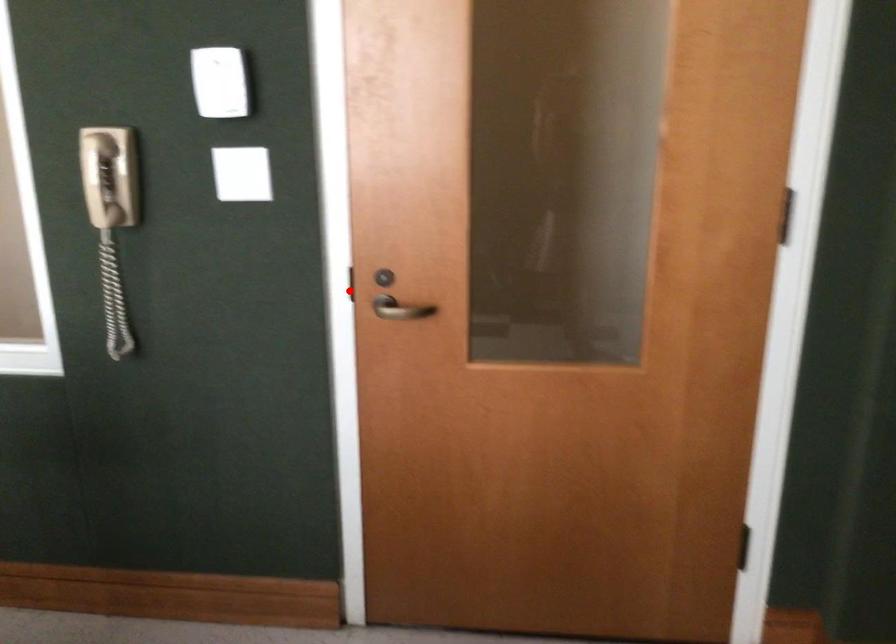
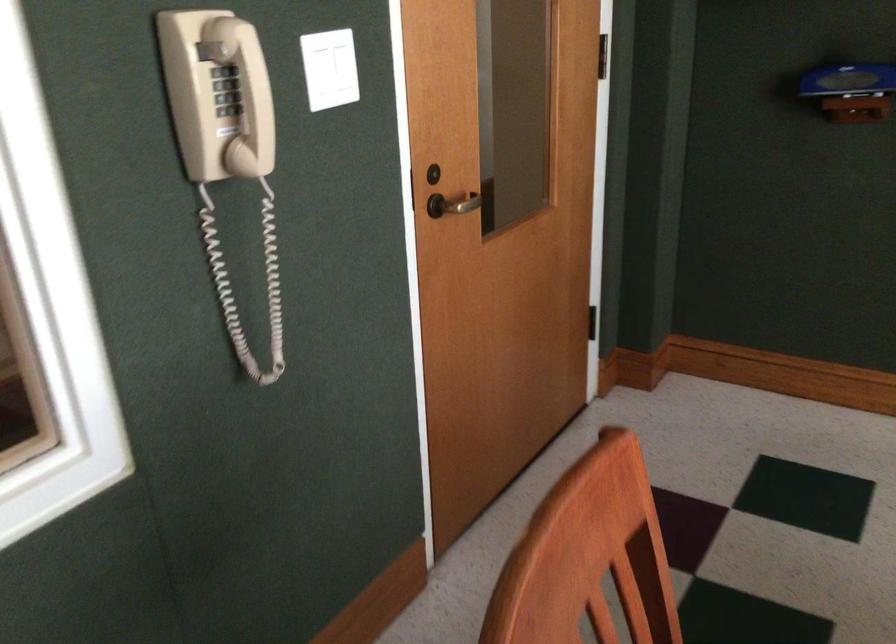
Where in the second image is the point corresponding to the highlighted location from the first image?

(409, 191)